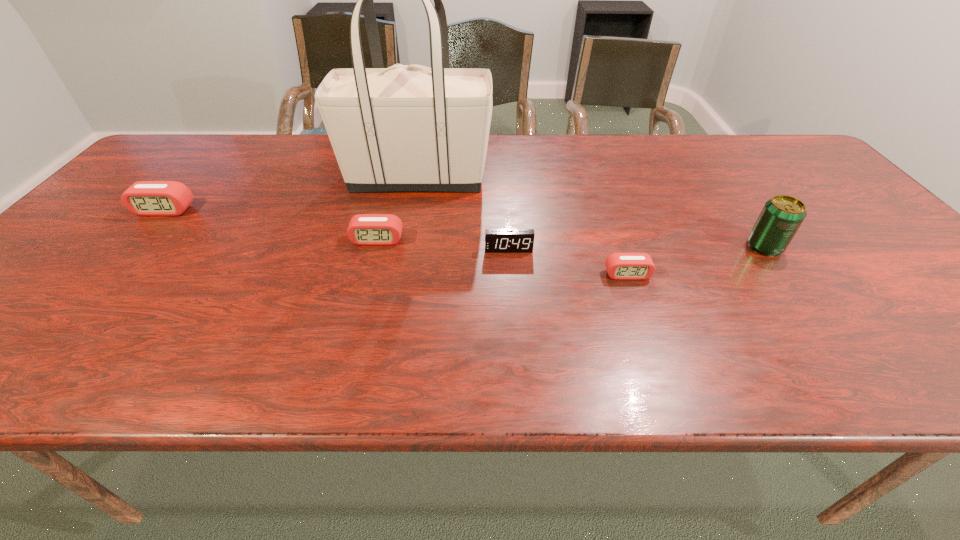
Identify the location of vacant space located 0.100m on the front-facing side of the leftmost alarm clock. The height and width of the screenshot is (540, 960). (137, 242).

This screenshot has height=540, width=960. Find the location of `vacant area located on the front-facing side of the third alarm clock from right to left`. vacant area located on the front-facing side of the third alarm clock from right to left is located at coordinates (357, 316).

The image size is (960, 540). Identify the location of vacant space positioned 0.150m on the front-facing side of the rightmost alarm clock. (648, 335).

Identify the location of free space located 0.240m with handles facing forward on the farthest object. (575, 178).

Identify the location of vacant space located on the front of the beer can. (783, 273).

I want to click on free space located on the front-facing side of the third alarm clock from left to right, so click(514, 322).

Find the location of a particular element. This screenshot has width=960, height=540. object present at the far edge is located at coordinates (412, 128).

The width and height of the screenshot is (960, 540). In order to click on object that is positioned at the left edge in this screenshot , I will do [x=144, y=198].

In the image, there is a desktop. Where is `free space at the far edge`? The image size is (960, 540). free space at the far edge is located at coordinates (302, 151).

In the image, there is a desktop. Identify the location of vacant area at the near edge. (733, 322).